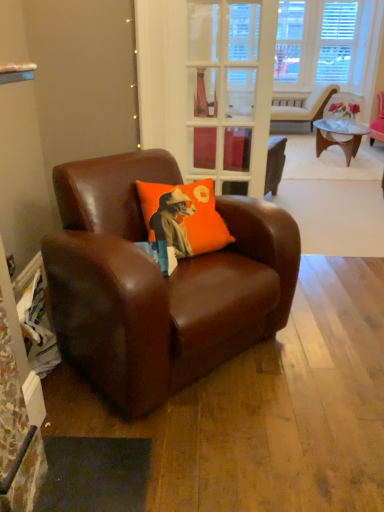
Question: Is orange fabric pillow at center at the right side of brown leather chair at left, arranged as the first chair when viewed from the left?

Choices:
 (A) no
 (B) yes

Answer: (B)

Question: From a real-world perspective, is orange fabric pillow at center positioned over brown leather chair at left, arranged as the first chair when viewed from the left, based on gravity?

Choices:
 (A) yes
 (B) no

Answer: (A)

Question: Could you tell me if orange fabric pillow at center is turned towards brown leather chair at left, the second chair in the top-to-bottom sequence?

Choices:
 (A) yes
 (B) no

Answer: (A)

Question: Is orange fabric pillow at center closer to the viewer compared to brown leather chair at left, which is the second chair from right to left?

Choices:
 (A) no
 (B) yes

Answer: (A)

Question: Considering the relative sizes of orange fabric pillow at center and brown leather chair at left, the second chair in the top-to-bottom sequence, in the image provided, is orange fabric pillow at center smaller than brown leather chair at left, the second chair in the top-to-bottom sequence,?

Choices:
 (A) no
 (B) yes

Answer: (B)

Question: Is orange fabric pillow at center positioned beyond the bounds of brown leather chair at left, which ranks as the first chair in bottom-to-top order?

Choices:
 (A) no
 (B) yes

Answer: (A)

Question: Is matte brown armchair at upper right, which appears as the first chair when viewed from the back, oriented towards clear glass door at center?

Choices:
 (A) no
 (B) yes

Answer: (B)

Question: Does matte brown armchair at upper right, which appears as the first chair when viewed from the back, have a lesser height compared to clear glass door at center?

Choices:
 (A) yes
 (B) no

Answer: (A)

Question: Is the surface of matte brown armchair at upper right, positioned as the 2th chair in front-to-back order, in direct contact with clear glass door at center?

Choices:
 (A) no
 (B) yes

Answer: (A)

Question: Can we say matte brown armchair at upper right, the second chair positioned from the bottom, lies outside clear glass door at center?

Choices:
 (A) yes
 (B) no

Answer: (A)

Question: From the image's perspective, is matte brown armchair at upper right, which is counted as the first chair, starting from the right, on clear glass door at center?

Choices:
 (A) yes
 (B) no

Answer: (A)

Question: From a real-world perspective, does matte brown armchair at upper right, which is counted as the first chair, starting from the right, stand above clear glass door at center?

Choices:
 (A) no
 (B) yes

Answer: (A)

Question: Is brown leather chair at left, the second chair in the top-to-bottom sequence, closer to the viewer compared to matte brown armchair at upper right, which is counted as the first chair, starting from the top?

Choices:
 (A) yes
 (B) no

Answer: (A)